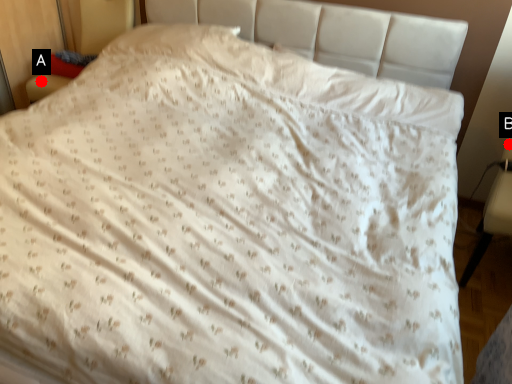
Question: Two points are circled on the image, labeled by A and B beside each circle. Which of the following is the closest to the observer?

Choices:
 (A) A is closer
 (B) B is closer

Answer: (B)